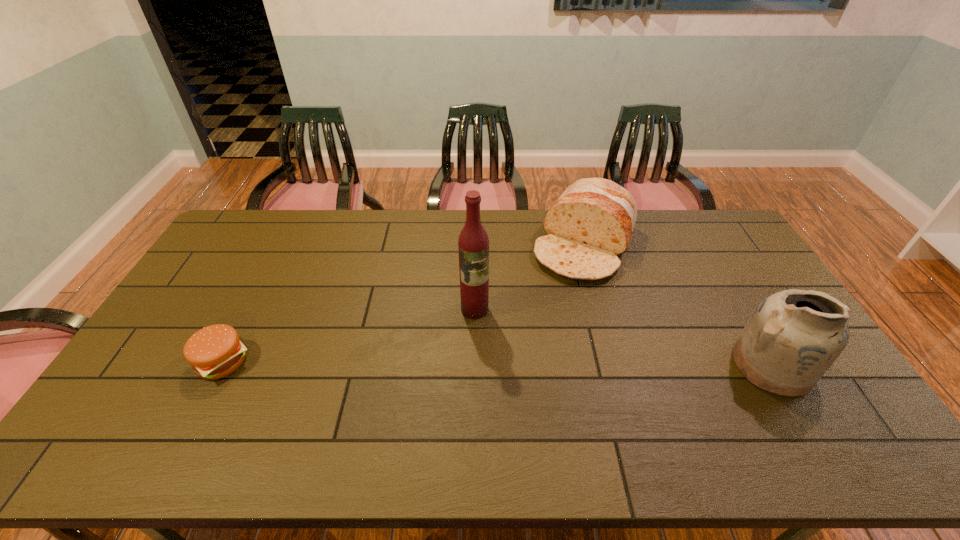
Find the location of `the shortest object`. the shortest object is located at coordinates (215, 351).

The height and width of the screenshot is (540, 960). I want to click on the leftmost object, so click(215, 351).

Find the location of a particular element. the rightmost object is located at coordinates (794, 336).

The width and height of the screenshot is (960, 540). Identify the location of the second tallest object. (794, 336).

At what (x,y) coordinates should I click in order to perform the action: click on liquor. Please return your answer as a coordinate pair (x, y). The width and height of the screenshot is (960, 540). Looking at the image, I should click on click(473, 244).

Where is `the tallest object`? Image resolution: width=960 pixels, height=540 pixels. the tallest object is located at coordinates (473, 244).

Find the location of a particular element. The image size is (960, 540). the second object from right to left is located at coordinates (592, 222).

The width and height of the screenshot is (960, 540). I want to click on the second shortest object, so click(592, 222).

You are a GUI agent. You are given a task and a screenshot of the screen. Output one action in this format:
    pyautogui.click(x=<x>, y=<y>)
    Task: Click on the free space located 0.380m on the right of the hamburger
    The image size is (960, 540).
    Given the screenshot: What is the action you would take?
    pyautogui.click(x=388, y=362)

The width and height of the screenshot is (960, 540). Identify the location of vacant space situated on the left of the rightmost object. (617, 365).